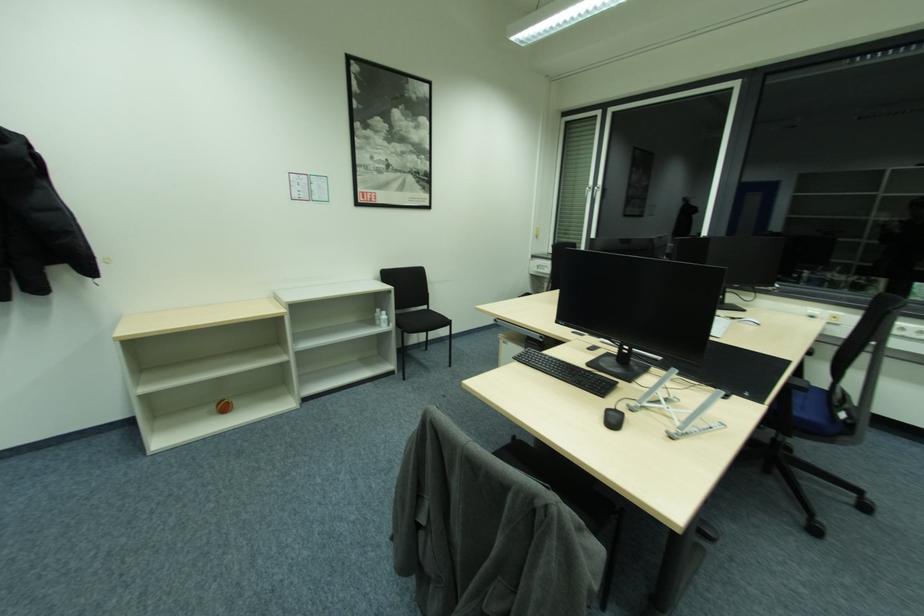
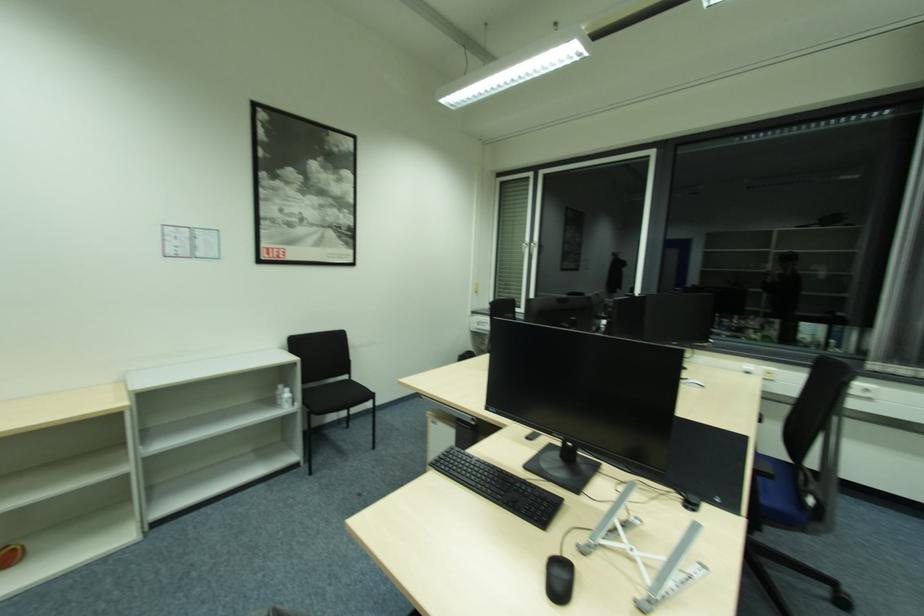
Question: How did the camera likely rotate?

Choices:
 (A) Left
 (B) Right
 (C) Up
 (D) Down

Answer: (C)